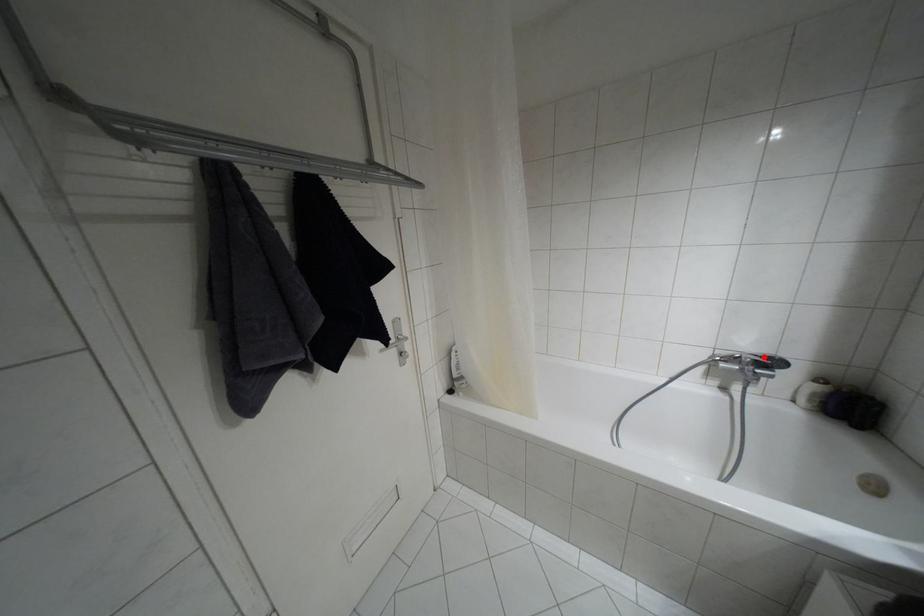
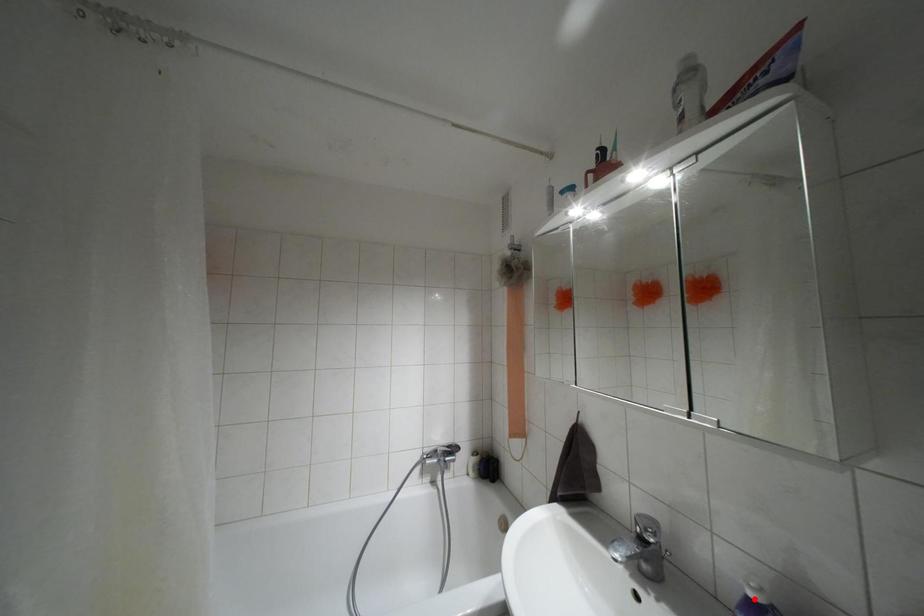
I am providing you with two images of the same scene from different viewpoints. A red point is marked on the first image and another point is marked on the second image. Do the highlighted points in image1 and image2 indicate the same real-world spot?

No